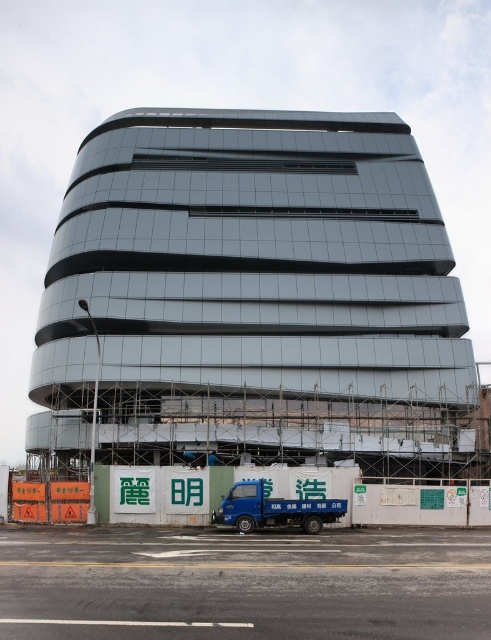
You are a delivery driver with a truck that is 10 meters long. You need to park your truck in front of the glassy metallic building at center. The parking area in front of the building is 60 meters long. Can you park your truck there without overlapping the building or the temporary fence?

The distance between the glassy metallic building at center and the camera is 57.24 meters. Since the parking area is 60 meters long and your truck is only 10 meters long, there is sufficient space to park without overlapping the building or the temporary fence.

You are standing at the origin point of a coordinate system placed at the bottom left corner of the image. You want to walk directly towards the glassy metallic building at center. In which direction should you head?

Since the glassy metallic building at center is located at coordinate point (253,298), you should head northeast to reach it from the origin at the bottom left corner.